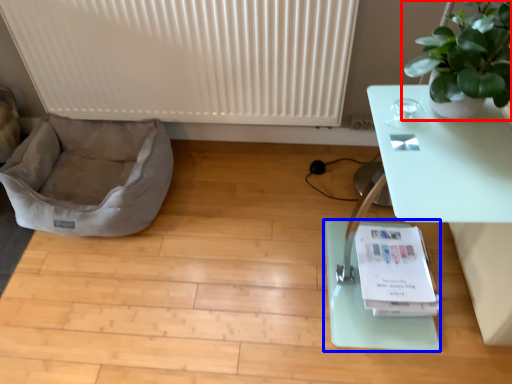
Question: Which object appears farthest to the camera in this image, houseplant (highlighted by a red box) or yoga mat (highlighted by a blue box)?

Choices:
 (A) houseplant
 (B) yoga mat

Answer: (B)